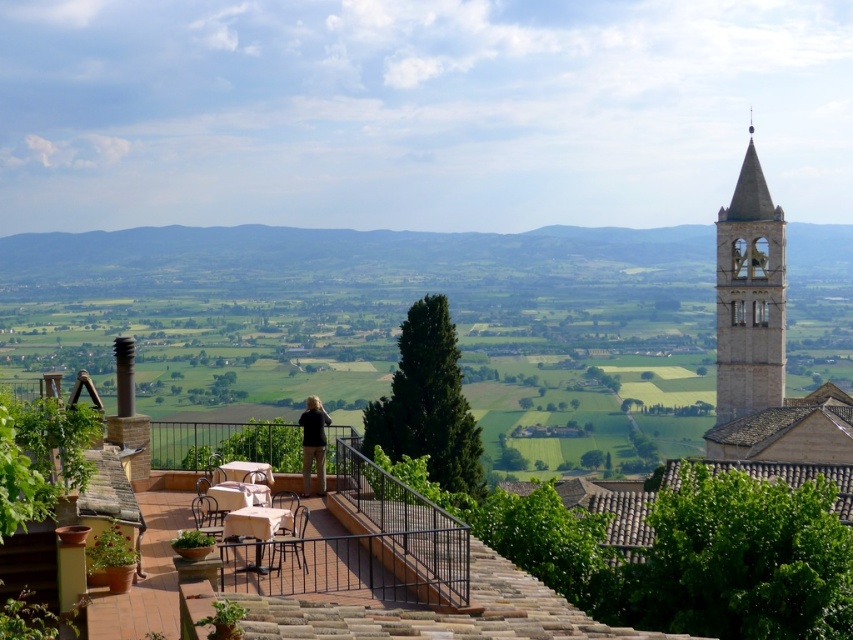
Question: Where is metallic brown chair at lower center located in relation to metallic silver chair at lower left in the image?

Choices:
 (A) right
 (B) left

Answer: (A)

Question: Which point is farther to the camera?

Choices:
 (A) beige stone bell tower at right
 (B) wooden table at center
 (C) wooden chair at lower center

Answer: (A)

Question: Which object appears farthest from the camera in this image?

Choices:
 (A) metallic brown chair at lower center
 (B) beige fabric-covered table at lower left
 (C) dark brown leather jacket at center
 (D) beige stone bell tower at right

Answer: (D)

Question: Observing the image, what is the correct spatial positioning of metallic silver table at lower center in reference to metallic brown chair at lower center?

Choices:
 (A) above
 (B) below

Answer: (A)

Question: Is beige fabric-covered table at lower left wider than wooden chair at lower left?

Choices:
 (A) no
 (B) yes

Answer: (B)

Question: Which is farther from the metallic silver chair at lower left?

Choices:
 (A) wooden chair at lower left
 (B) dark brown leather jacket at center
 (C) metallic brown chair at lower center
 (D) metallic silver table at lower center

Answer: (B)